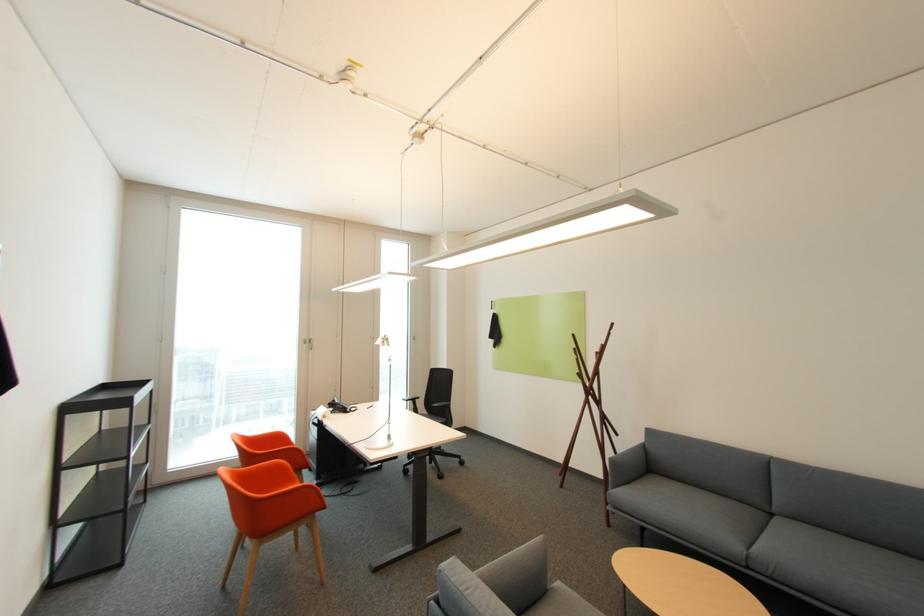
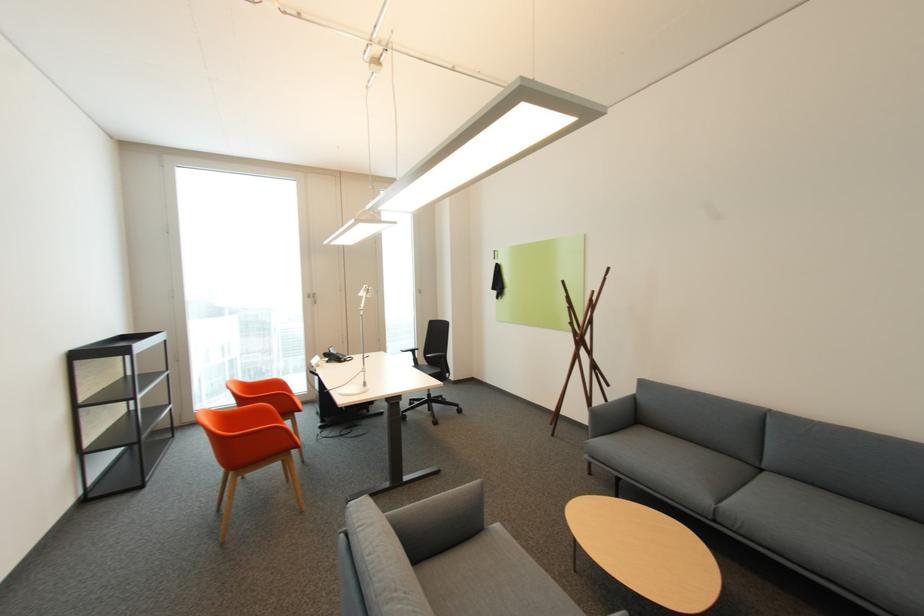
Question: The images are taken continuously from a first-person perspective. In which direction are you moving?

Choices:
 (A) Left
 (B) Right
 (C) Forward
 (D) Backward

Answer: (B)